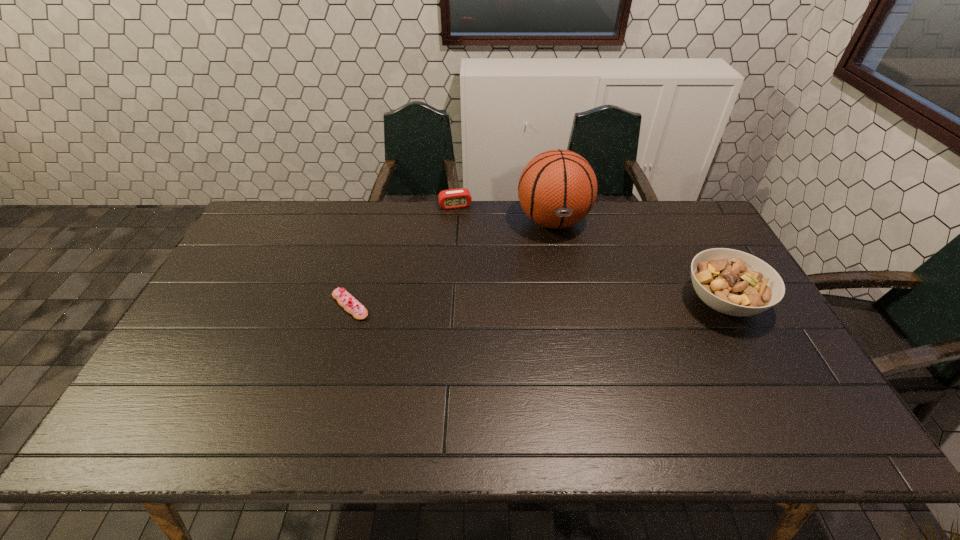
The width and height of the screenshot is (960, 540). Identify the location of vacant space at the near edge. (356, 402).

This screenshot has width=960, height=540. In order to click on vacant space at the left edge of the desktop in this screenshot , I will do `click(223, 282)`.

Locate an element on the screen. vacant space at the near left corner of the desktop is located at coordinates (186, 402).

At what (x,y) coordinates should I click in order to perform the action: click on unoccupied position between the second tallest object and the second object from right to left. Please return your answer as a coordinate pair (x, y). This screenshot has height=540, width=960. Looking at the image, I should click on (637, 261).

Locate an element on the screen. The image size is (960, 540). unoccupied area between the tallest object and the stew is located at coordinates (637, 261).

The height and width of the screenshot is (540, 960). I want to click on unoccupied area between the shortest object and the third shortest object, so click(x=537, y=303).

Identify the location of free space between the shortest object and the alarm clock. The width and height of the screenshot is (960, 540). (402, 255).

Where is `blank region between the rightmost object and the leftmost object`? The height and width of the screenshot is (540, 960). blank region between the rightmost object and the leftmost object is located at coordinates (537, 303).

Find the location of a particular element. This screenshot has height=540, width=960. free space between the eclair and the second object from left to right is located at coordinates (402, 255).

Where is `free space between the second tallest object and the tallest object`? This screenshot has height=540, width=960. free space between the second tallest object and the tallest object is located at coordinates (637, 261).